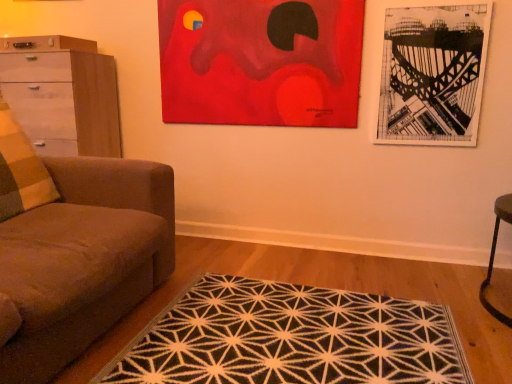
Describe the element at coordinates (261, 62) in the screenshot. I see `red acrylic painting at upper center, which is counted as the 2th picture frame, starting from the right` at that location.

What is the approximate width of brown fabric couch at left?

brown fabric couch at left is 1.28 meters wide.

What do you see at coordinates (20, 170) in the screenshot? This screenshot has height=384, width=512. I see `checkered fabric pillow at left` at bounding box center [20, 170].

The image size is (512, 384). Describe the element at coordinates (290, 338) in the screenshot. I see `black geometric rug at center` at that location.

The width and height of the screenshot is (512, 384). Find the location of `black paper picture frame at upper right, which ranks as the 2th picture frame in left-to-right order`. black paper picture frame at upper right, which ranks as the 2th picture frame in left-to-right order is located at coordinates (433, 75).

You are a GUI agent. You are given a task and a screenshot of the screen. Output one action in this format:
    pyautogui.click(x=<x>, y=<y>)
    Task: Click on the red acrylic painting at upper center, which is the first picture frame in left-to-right order
    
    Given the screenshot: What is the action you would take?
    pyautogui.click(x=261, y=62)

Identify the location of picture frame that is the 1st one when counting backward from the black geometric rug at center. (433, 75).

Is black geometric rug at center at the left side of black paper picture frame at upper right, which ranks as the 2th picture frame in left-to-right order?

Correct, you'll find black geometric rug at center to the left of black paper picture frame at upper right, which ranks as the 2th picture frame in left-to-right order.

Considering the relative sizes of black geometric rug at center and black paper picture frame at upper right, acting as the first picture frame starting from the right, in the image provided, is black geometric rug at center shorter than black paper picture frame at upper right, acting as the first picture frame starting from the right,?

Yes, black geometric rug at center is shorter than black paper picture frame at upper right, acting as the first picture frame starting from the right.

Does white glossy chest of drawers at left have a lesser height compared to black geometric rug at center?

Incorrect, the height of white glossy chest of drawers at left does not fall short of that of black geometric rug at center.

Between point (37, 120) and point (424, 355), which one is positioned behind?

Positioned behind is point (37, 120).

Is white glossy chest of drawers at left to the left of black geometric rug at center from the viewer's perspective?

Yes.

Is white glossy chest of drawers at left smaller than black geometric rug at center?

Actually, white glossy chest of drawers at left might be larger than black geometric rug at center.

Is point (458, 130) closer or farther from the camera than point (105, 204)?

Point (458, 130) is farther from the camera than point (105, 204).

Is black paper picture frame at upper right, which ranks as the 2th picture frame in left-to-right order, surrounding brown fabric couch at left?

No, brown fabric couch at left is located outside of black paper picture frame at upper right, which ranks as the 2th picture frame in left-to-right order.

From the image's perspective, which one is positioned higher, black paper picture frame at upper right, acting as the first picture frame starting from the right, or brown fabric couch at left?

black paper picture frame at upper right, acting as the first picture frame starting from the right, from the image's perspective.

Is there a large distance between black paper picture frame at upper right, which ranks as the 2th picture frame in left-to-right order, and brown fabric couch at left?

black paper picture frame at upper right, which ranks as the 2th picture frame in left-to-right order, is positioned a significant distance from brown fabric couch at left.

Is point (375, 302) positioned in front of point (162, 44)?

Yes.

Is red acrylic painting at upper center, which is the first picture frame in left-to-right order, at the back of black geometric rug at center?

No, black geometric rug at center is not facing the opposite direction of red acrylic painting at upper center, which is the first picture frame in left-to-right order.

Is black geometric rug at center shorter than red acrylic painting at upper center, which is the first picture frame in left-to-right order?

Correct, black geometric rug at center is not as tall as red acrylic painting at upper center, which is the first picture frame in left-to-right order.

From the image's perspective, would you say black geometric rug at center is positioned over red acrylic painting at upper center, which is the first picture frame in left-to-right order?

No, from the image's perspective, black geometric rug at center is not on top of red acrylic painting at upper center, which is the first picture frame in left-to-right order.

Where is `mat below the red acrylic painting at upper center, which is counted as the 2th picture frame, starting from the right (from the image's perspective)`? The width and height of the screenshot is (512, 384). mat below the red acrylic painting at upper center, which is counted as the 2th picture frame, starting from the right (from the image's perspective) is located at coordinates (290, 338).

Based on the photo, in terms of height, does red acrylic painting at upper center, which is counted as the 2th picture frame, starting from the right, look taller or shorter compared to black geometric rug at center?

Considering their sizes, red acrylic painting at upper center, which is counted as the 2th picture frame, starting from the right, has more height than black geometric rug at center.

What's the angular difference between red acrylic painting at upper center, which is counted as the 2th picture frame, starting from the right, and black geometric rug at center's facing directions?

179 degrees.

Could you tell me if red acrylic painting at upper center, which is the first picture frame in left-to-right order, is facing black geometric rug at center?

No, red acrylic painting at upper center, which is the first picture frame in left-to-right order, is not oriented towards black geometric rug at center.

Considering the positions of objects black geometric rug at center and checkered fabric pillow at left in the image provided, who is more to the left, black geometric rug at center or checkered fabric pillow at left?

checkered fabric pillow at left.

Considering the relative sizes of black geometric rug at center and checkered fabric pillow at left in the image provided, is black geometric rug at center shorter than checkered fabric pillow at left?

Yes, black geometric rug at center is shorter than checkered fabric pillow at left.

Is point (188, 325) positioned behind point (51, 200)?

That is False.

Can you confirm if black geometric rug at center is wider than checkered fabric pillow at left?

Yes, black geometric rug at center is wider than checkered fabric pillow at left.

Between checkered fabric pillow at left and black geometric rug at center, which one has larger width?

black geometric rug at center.

Can you confirm if checkered fabric pillow at left is smaller than black geometric rug at center?

Correct, checkered fabric pillow at left occupies less space than black geometric rug at center.

Can black geometric rug at center be found inside checkered fabric pillow at left?

Definitely not — black geometric rug at center is not inside checkered fabric pillow at left.

From the image's perspective, which one is positioned higher, checkered fabric pillow at left or black geometric rug at center?

checkered fabric pillow at left appears higher in the image.

Where is `the 1st picture frame above the black geometric rug at center (from the image's perspective)`? This screenshot has height=384, width=512. the 1st picture frame above the black geometric rug at center (from the image's perspective) is located at coordinates click(x=433, y=75).

You are a GUI agent. You are given a task and a screenshot of the screen. Output one action in this format:
    pyautogui.click(x=<x>, y=<y>)
    Task: Click on the chest of drawers located above the black geometric rug at center (from a real-world perspective)
    The height and width of the screenshot is (384, 512).
    Given the screenshot: What is the action you would take?
    pos(62,94)

Based on their spatial positions, is black paper picture frame at upper right, acting as the first picture frame starting from the right, or brown fabric couch at left closer to white glossy chest of drawers at left?

Based on the image, brown fabric couch at left appears to be nearer to white glossy chest of drawers at left.

Based on their spatial positions, is checkered fabric pillow at left or black paper picture frame at upper right, which ranks as the 2th picture frame in left-to-right order, closer to brown fabric couch at left?

checkered fabric pillow at left is positioned closer to the anchor brown fabric couch at left.

Considering their positions, is brown fabric couch at left positioned further to white glossy chest of drawers at left than black geometric rug at center?

Among the two, black geometric rug at center is located further to white glossy chest of drawers at left.

Estimate the real-world distances between objects in this image. Which object is further from checkered fabric pillow at left, black paper picture frame at upper right, acting as the first picture frame starting from the right, or red acrylic painting at upper center, which is the first picture frame in left-to-right order?

black paper picture frame at upper right, acting as the first picture frame starting from the right, is further to checkered fabric pillow at left.

Estimate the real-world distances between objects in this image. Which object is closer to black paper picture frame at upper right, which ranks as the 2th picture frame in left-to-right order, red acrylic painting at upper center, which is counted as the 2th picture frame, starting from the right, or black geometric rug at center?

red acrylic painting at upper center, which is counted as the 2th picture frame, starting from the right, is closer to black paper picture frame at upper right, which ranks as the 2th picture frame in left-to-right order.

Considering their positions, is white glossy chest of drawers at left positioned closer to black paper picture frame at upper right, acting as the first picture frame starting from the right, than red acrylic painting at upper center, which is the first picture frame in left-to-right order?

red acrylic painting at upper center, which is the first picture frame in left-to-right order.

From the image, which object appears to be farther from checkered fabric pillow at left, black paper picture frame at upper right, acting as the first picture frame starting from the right, or white glossy chest of drawers at left?

The object further to checkered fabric pillow at left is black paper picture frame at upper right, acting as the first picture frame starting from the right.

Based on their spatial positions, is checkered fabric pillow at left or white glossy chest of drawers at left closer to black paper picture frame at upper right, which ranks as the 2th picture frame in left-to-right order?

white glossy chest of drawers at left.

Where is `pillow between brown fabric couch at left and white glossy chest of drawers at left along the z-axis`? Image resolution: width=512 pixels, height=384 pixels. pillow between brown fabric couch at left and white glossy chest of drawers at left along the z-axis is located at coordinates (20, 170).

The image size is (512, 384). In order to click on picture frame located between checkered fabric pillow at left and black geometric rug at center in the left-right direction in this screenshot , I will do `click(261, 62)`.

Locate an element on the screen. The width and height of the screenshot is (512, 384). studio couch located between checkered fabric pillow at left and black geometric rug at center in the left-right direction is located at coordinates (74, 250).

Where is `pillow between white glossy chest of drawers at left and red acrylic painting at upper center, which is counted as the 2th picture frame, starting from the right, in the horizontal direction`? pillow between white glossy chest of drawers at left and red acrylic painting at upper center, which is counted as the 2th picture frame, starting from the right, in the horizontal direction is located at coordinates (20, 170).